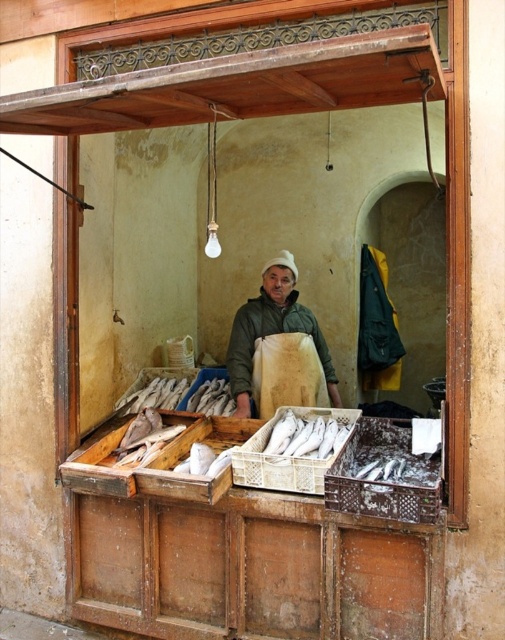
From the picture: Does green matte jacket at center come behind white plastic fish at center?

Yes, it is behind white plastic fish at center.

Does point (242, 392) lie in front of point (295, 422)?

No.

The image size is (505, 640). Find the location of `green matte jacket at center`. green matte jacket at center is located at coordinates (278, 348).